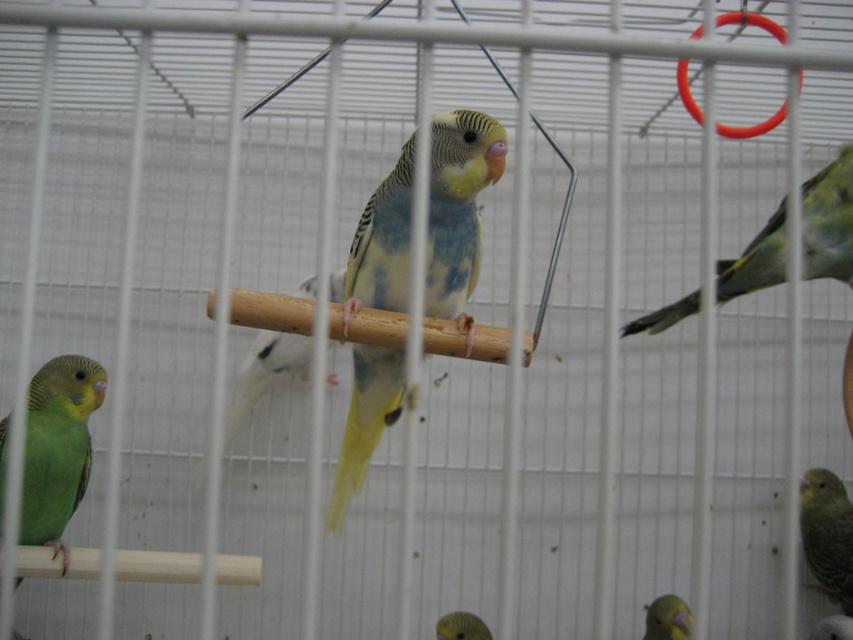
Question: Does yellow-green feathered parrot at center have a larger size compared to green matte parrot at lower left?

Choices:
 (A) yes
 (B) no

Answer: (A)

Question: Does green matte parrot at right have a smaller size compared to green matte parrot at lower center?

Choices:
 (A) yes
 (B) no

Answer: (B)

Question: Which point appears closest to the camera in this image?

Choices:
 (A) (815, 572)
 (B) (762, 264)
 (C) (370, 214)

Answer: (C)

Question: Among these objects, which one is farthest from the camera?

Choices:
 (A) yellow-green feathered parrot at center
 (B) green matte parrot at lower right
 (C) green matte parrot at lower center

Answer: (B)

Question: Does green matte parrot at right have a larger size compared to green matte parrot at lower center?

Choices:
 (A) yes
 (B) no

Answer: (A)

Question: Among these objects, which one is farthest from the camera?

Choices:
 (A) green matte parrot at lower left
 (B) green matte parrot at lower center
 (C) yellow-green feathered parrot at center
 (D) green matte parrot at right

Answer: (B)